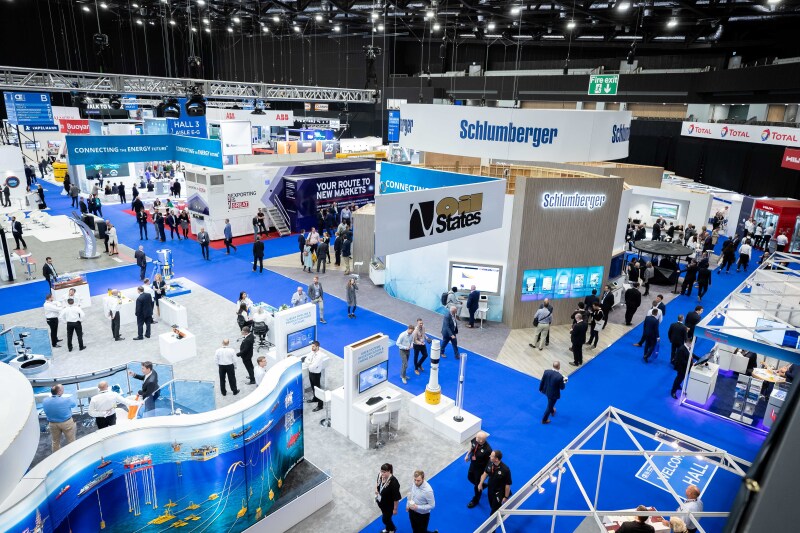
Where is `partition wall`? This screenshot has width=800, height=533. partition wall is located at coordinates (176, 481).